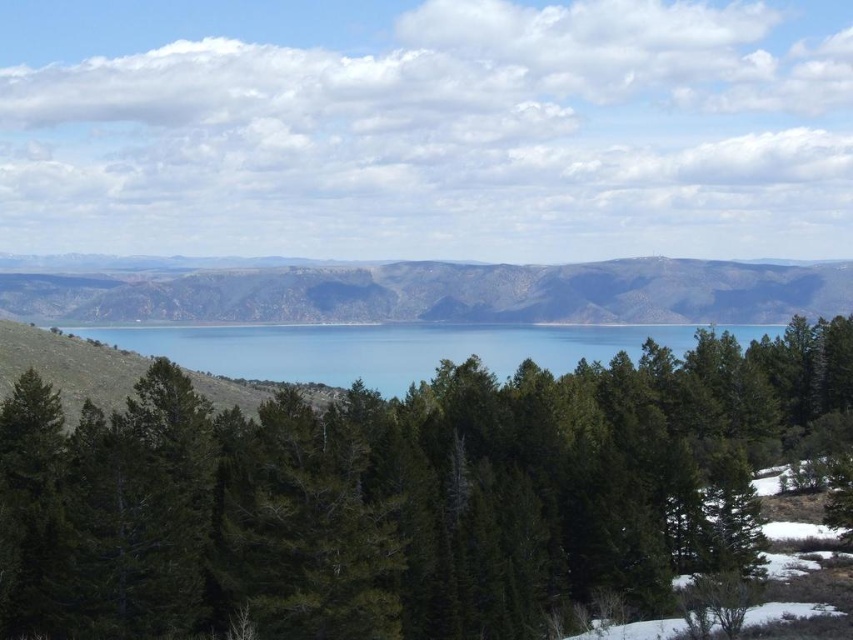
Who is more forward, (560, 605) or (345, 278)?

Point (560, 605)

Does green matte tree at center appear on the left side of brown rocky mountains at center?

No, green matte tree at center is not to the left of brown rocky mountains at center.

What are the coordinates of `green matte tree at center` in the screenshot? It's located at (403, 493).

Locate an element on the screen. This screenshot has width=853, height=640. green matte tree at center is located at coordinates (403, 493).

Does green matte tree at center have a smaller size compared to blue water at center?

Correct, green matte tree at center occupies less space than blue water at center.

Is green matte tree at center wider than blue water at center?

No, green matte tree at center is not wider than blue water at center.

Does point (144, 566) lie behind point (227, 330)?

No, (144, 566) is closer to viewer.

Where is `green matte tree at center`? Image resolution: width=853 pixels, height=640 pixels. green matte tree at center is located at coordinates (403, 493).

Does brown rocky mountains at center have a lesser width compared to blue water at center?

In fact, brown rocky mountains at center might be wider than blue water at center.

Does brown rocky mountains at center appear under blue water at center?

No.

Find the location of a particular element. Image resolution: width=853 pixels, height=640 pixels. brown rocky mountains at center is located at coordinates (437, 292).